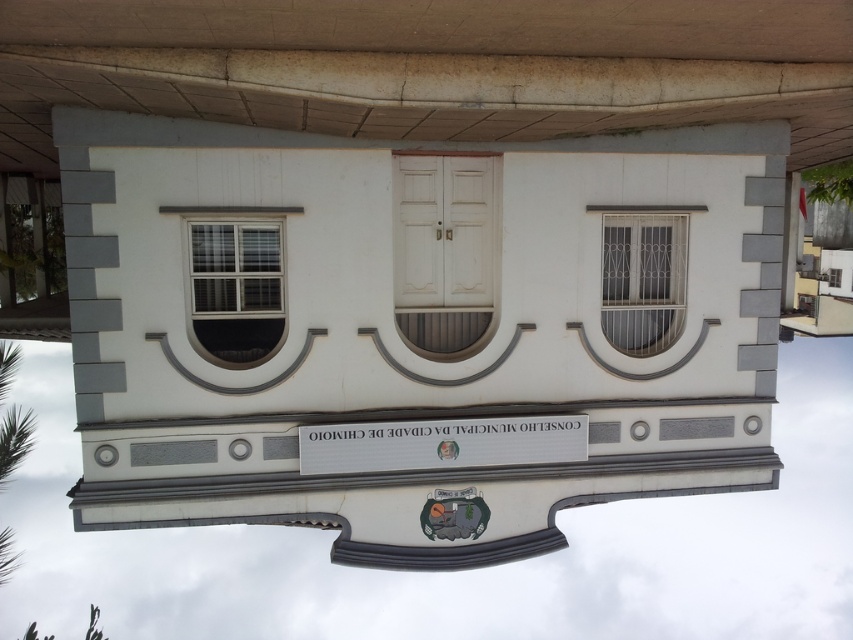
Looking at this image, who is lower down, white plastic sign at center or matte glass window at center?

white plastic sign at center

Measure the distance between point (532, 436) and camera.

16.56 meters

Is point (447, 419) positioned behind point (201, 333)?

Yes, it is behind point (201, 333).

Identify the location of white plastic sign at center. (440, 444).

Can you confirm if white plastic sign at center is positioned to the left of white metal window at center?

Yes, white plastic sign at center is to the left of white metal window at center.

Who is higher up, white plastic sign at center or white metal window at center?

white metal window at center is above.

This screenshot has width=853, height=640. I want to click on white plastic sign at center, so [x=440, y=444].

Who is lower down, matte glass window at center or white metal window at center?

matte glass window at center

Does point (207, 292) lie in front of point (602, 236)?

Yes, point (207, 292) is in front of point (602, 236).

Consider the image. Who is more forward, (200,225) or (648,237)?

Point (200,225) is more forward.

Image resolution: width=853 pixels, height=640 pixels. What are the coordinates of `matte glass window at center` in the screenshot? It's located at (236, 291).